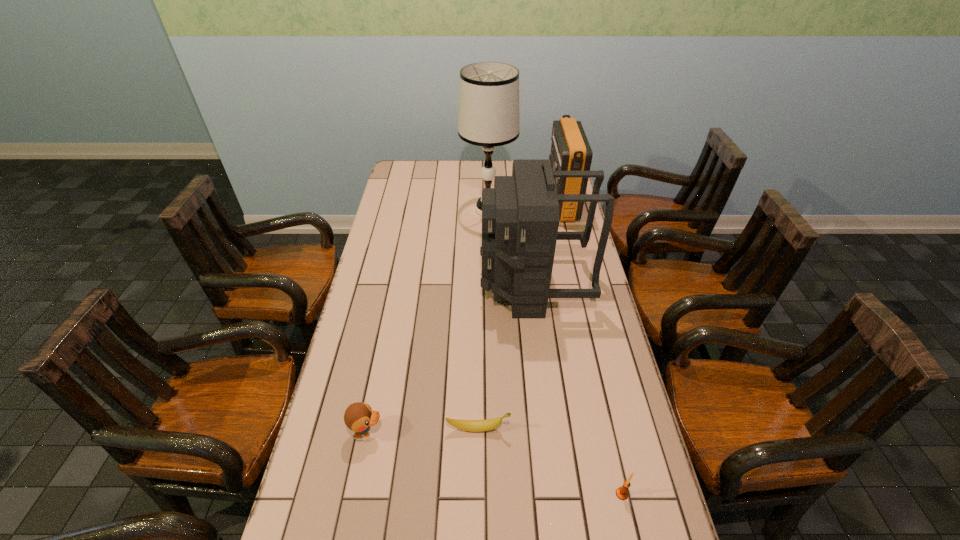
The image size is (960, 540). What are the coordinates of `free spot that satisfies the following two spatial constraints: 1. at the stem of the shortest object; 2. on the right side of the candle_holder` in the screenshot? It's located at (478, 494).

The height and width of the screenshot is (540, 960). What are the coordinates of `free location that satisfies the following two spatial constraints: 1. on the front side of the tallest object; 2. at the stem of the shortest object` in the screenshot? It's located at (492, 429).